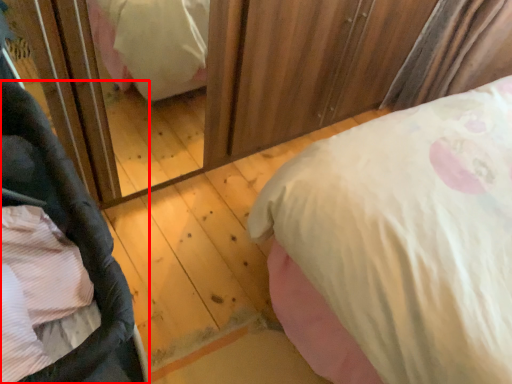
Question: From the image's perspective, considering the relative positions of baby carriage (annotated by the red box) and bed in the image provided, where is baby carriage (annotated by the red box) located with respect to the staircase?

Choices:
 (A) above
 (B) below

Answer: (B)